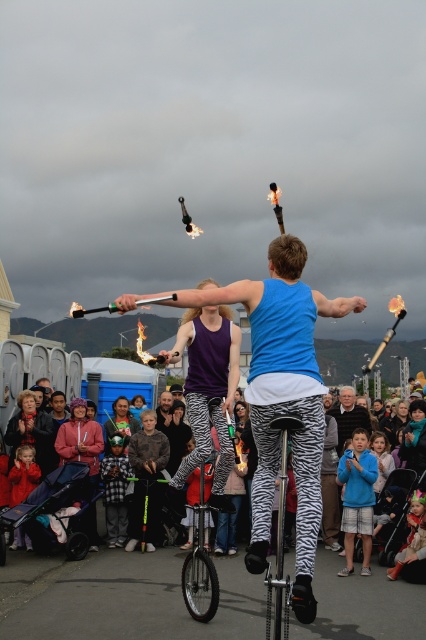
Between point (282, 362) and point (344, 396), which one is positioned behind?

Positioned behind is point (344, 396).

Who is shorter, zebra-patterned pants at center or gray hair at center?

With less height is gray hair at center.

Is point (275, 282) less distant than point (354, 422)?

Yes, point (275, 282) is closer to viewer.

The image size is (426, 640). What are the coordinates of `zebra-patterned pants at center` in the screenshot? It's located at (282, 396).

Is zebra-patterned pants at center wider than dark brown leather jacket at center?

Yes.

Is point (273, 262) positioned behind point (169, 417)?

No, it is in front of (169, 417).

Between point (284, 294) and point (161, 396), which one is positioned in front?

Point (284, 294)

Locate an element on the screen. The width and height of the screenshot is (426, 640). zebra-patterned pants at center is located at coordinates (282, 396).

Is point (28, 516) farther from camera compared to point (325, 413)?

No, it is not.

Can you confirm if zebra print monocycle at lower left is bigger than gray hair at center?

Incorrect, zebra print monocycle at lower left is not larger than gray hair at center.

What do you see at coordinates (48, 506) in the screenshot?
I see `zebra print monocycle at lower left` at bounding box center [48, 506].

The image size is (426, 640). I want to click on zebra print monocycle at lower left, so click(x=48, y=506).